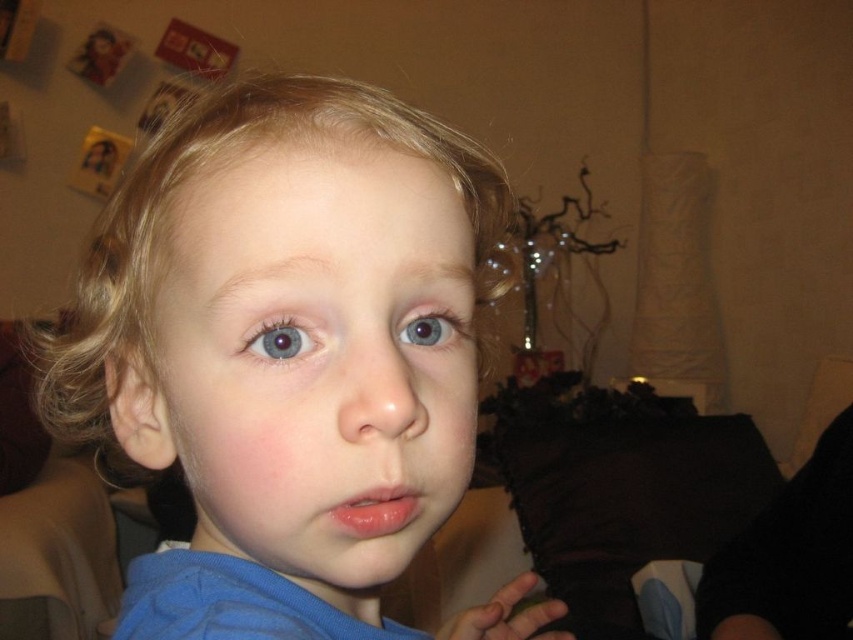
Question: Which point appears closest to the camera in this image?

Choices:
 (A) (408, 556)
 (B) (260, 340)
 (C) (329, 428)
 (D) (436, 323)

Answer: (C)

Question: Which point is farther to the camera?

Choices:
 (A) (79, 385)
 (B) (415, 310)

Answer: (A)

Question: Does smooth skin face at center have a smaller size compared to blue glossy eye at center?

Choices:
 (A) no
 (B) yes

Answer: (A)

Question: Considering the real-world distances, which object is closest to the smooth skin face at center?

Choices:
 (A) blue glossy eye at center
 (B) blue fabric shirt at center

Answer: (B)

Question: In this image, where is smooth skin face at center located relative to blue matte eye at center?

Choices:
 (A) above
 (B) below

Answer: (B)

Question: Can you confirm if blue fabric shirt at center is positioned to the left of blue matte eye at center?

Choices:
 (A) yes
 (B) no

Answer: (A)